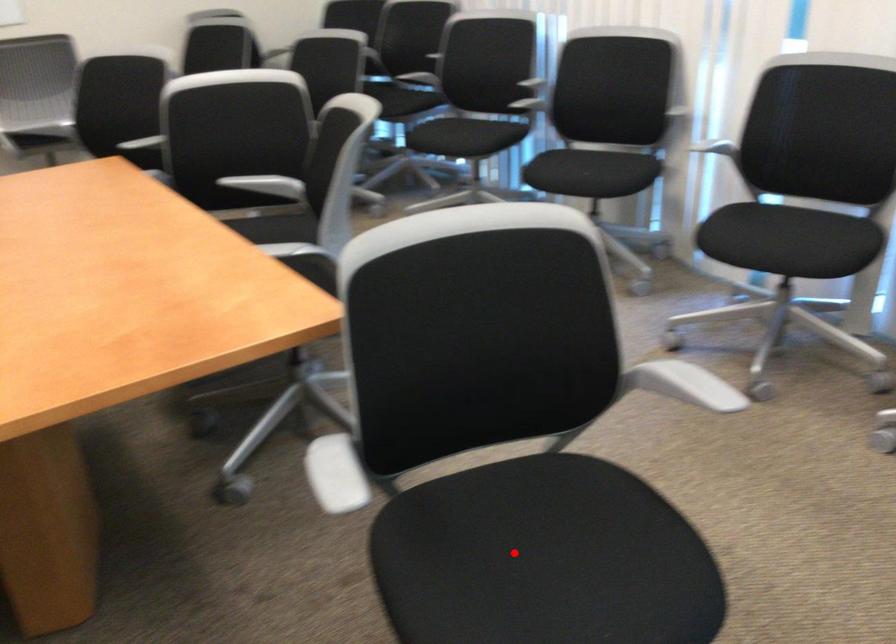
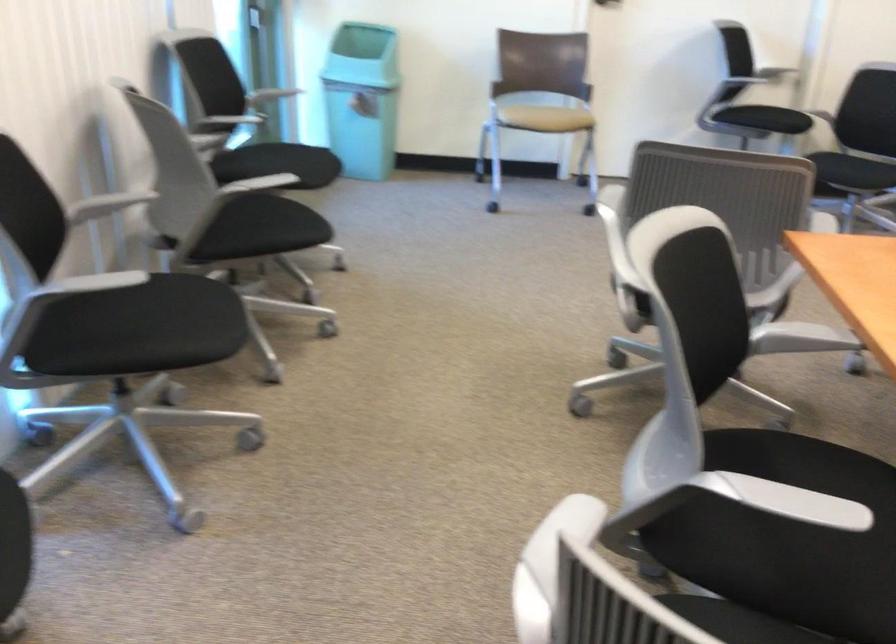
Question: I am providing you with two images of the same scene from different viewpoints. A red point is marked on the first image. Is the red point's position out of view in image 2?

Choices:
 (A) Yes
 (B) No

Answer: (A)